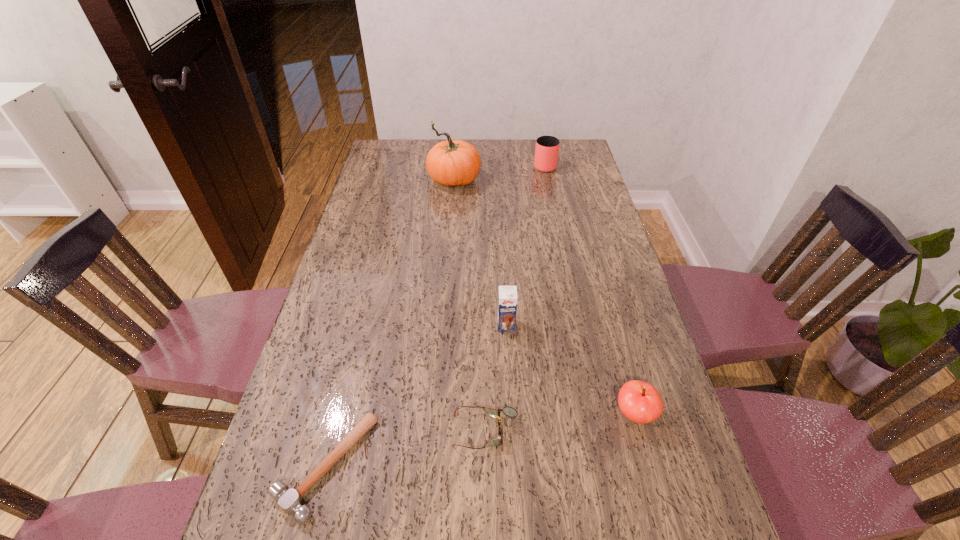
Locate an element on the screen. The width and height of the screenshot is (960, 540). the tallest object is located at coordinates (454, 162).

You are a GUI agent. You are given a task and a screenshot of the screen. Output one action in this format:
    pyautogui.click(x=<x>, y=<y>)
    Task: Click on the chocolate milk
    
    Given the screenshot: What is the action you would take?
    pyautogui.click(x=507, y=298)

The image size is (960, 540). In order to click on cup in this screenshot , I will do `click(547, 147)`.

Locate an element on the screen. Image resolution: width=960 pixels, height=540 pixels. apple is located at coordinates (640, 402).

The width and height of the screenshot is (960, 540). Find the location of `the fifth tallest object`. the fifth tallest object is located at coordinates (508, 411).

Where is `the leftmost object`? the leftmost object is located at coordinates (290, 500).

Identify the location of hammer. (290, 500).

Locate an element on the screen. Image resolution: width=960 pixels, height=540 pixels. vacant area situated 0.070m on the left of the tallest object is located at coordinates (409, 181).

The height and width of the screenshot is (540, 960). I want to click on free region located on the front label of the chocolate milk, so click(510, 397).

Locate an element on the screen. Image resolution: width=960 pixels, height=540 pixels. vacant space located 0.100m on the handle side of the cup is located at coordinates (540, 146).